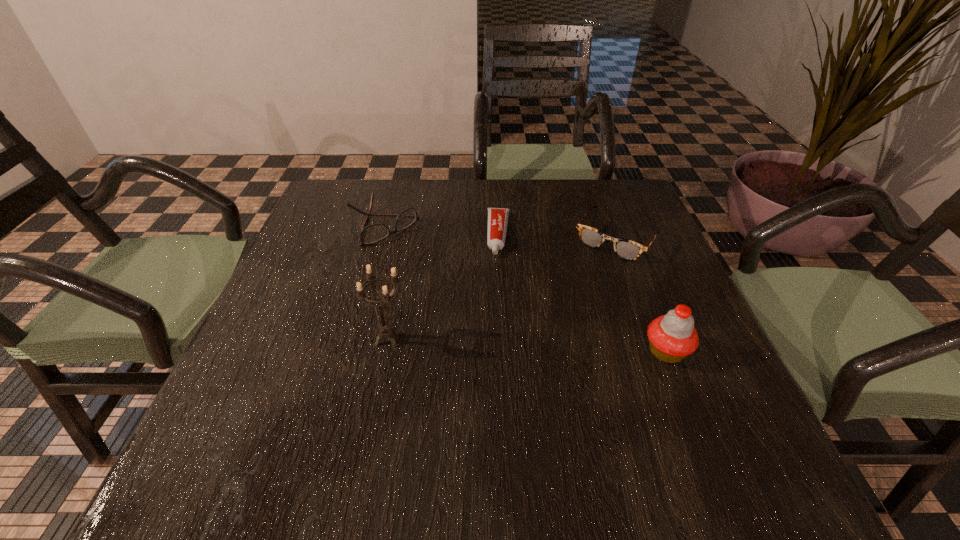
At what (x,y) coordinates should I click in order to perform the action: click on free space that satisfies the following two spatial constraints: 1. on the back side of the right spectacles; 2. on the left side of the candle holder. Please return your answer as a coordinate pair (x, y). The width and height of the screenshot is (960, 540). Looking at the image, I should click on (409, 238).

Find the location of a particular element. The image size is (960, 540). free location that satisfies the following two spatial constraints: 1. on the front side of the left spectacles; 2. on the right side of the cupcake is located at coordinates (348, 352).